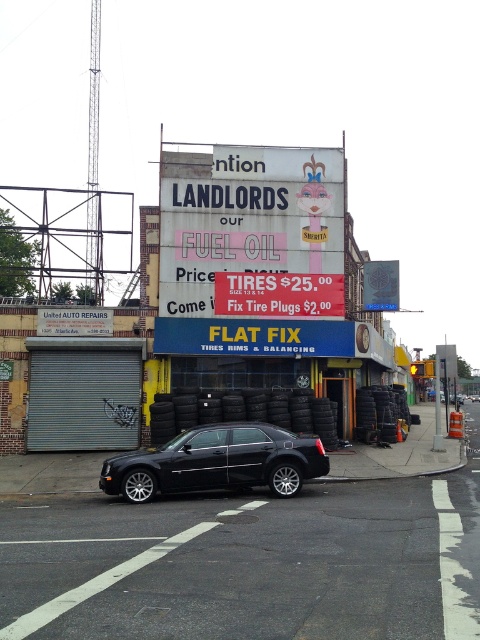
Is black matte car at center above black rubber tire at center?

No, black matte car at center is not above black rubber tire at center.

Describe the element at coordinates (217, 461) in the screenshot. This screenshot has width=480, height=640. I see `black matte car at center` at that location.

The height and width of the screenshot is (640, 480). What do you see at coordinates (217, 461) in the screenshot?
I see `black matte car at center` at bounding box center [217, 461].

Where is `black matte car at center`? black matte car at center is located at coordinates (217, 461).

Does black rubber tires at lower center lie behind black rubber tire at lower left?

Yes.

This screenshot has height=640, width=480. Describe the element at coordinates (381, 412) in the screenshot. I see `black rubber tires at lower center` at that location.

You are a GUI agent. You are given a task and a screenshot of the screen. Output one action in this format:
    pyautogui.click(x=<x>, y=<y>)
    Task: Click on the black rubber tires at lower center
    
    Given the screenshot: What is the action you would take?
    click(x=381, y=412)

Does white paper sign at center have a lesser height compared to black rubber tire at lower left?

Yes, white paper sign at center is shorter than black rubber tire at lower left.

Where is `white paper sign at center`? The width and height of the screenshot is (480, 640). white paper sign at center is located at coordinates point(247,220).